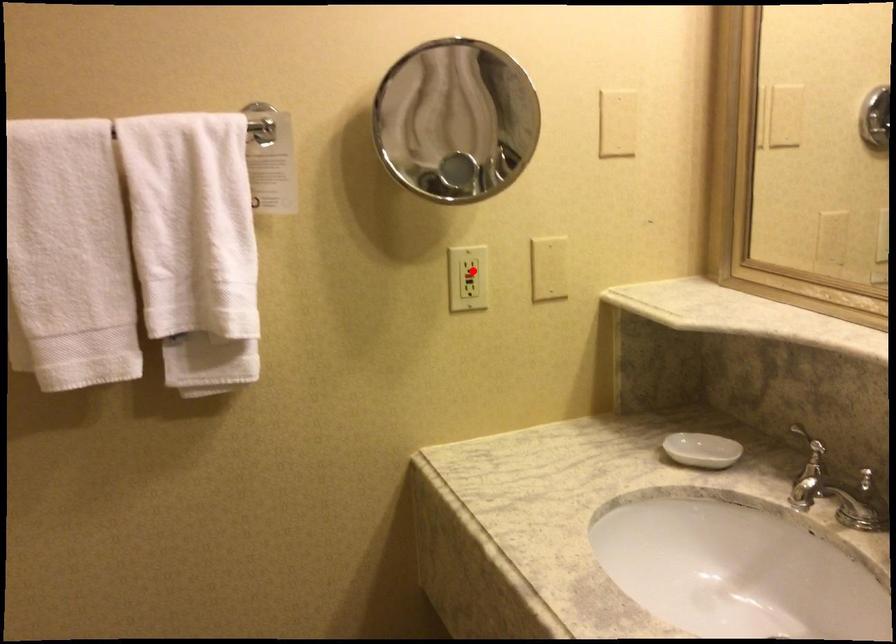
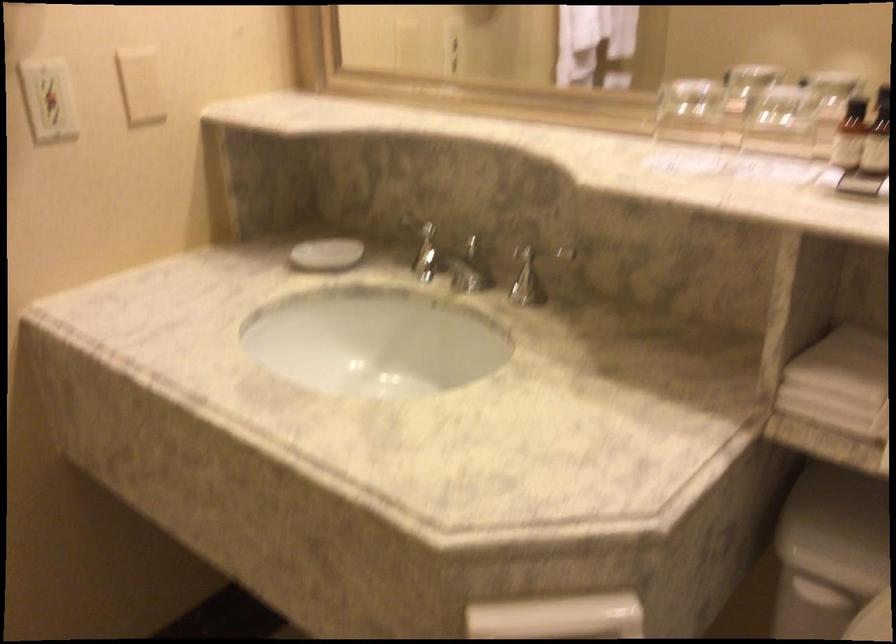
Question: I am providing you with two images of the same scene from different viewpoints. Image1 has a red point marked. In image2, the corresponding 3D location appears at what relative position? Reply with the corresponding letter.

Choices:
 (A) Closer
 (B) Farther

Answer: (A)